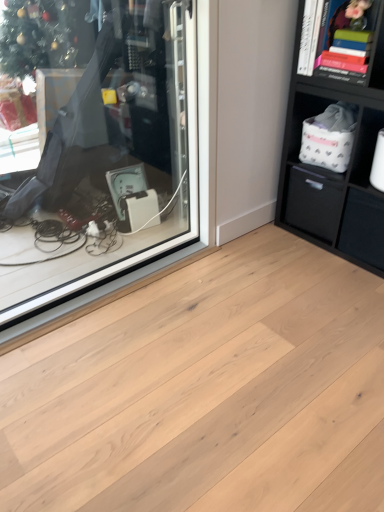
Question: Does transparent glass shop window at upper left have a greater width compared to matte black drawer at lower right, the 2th drawer when ordered from left to right?

Choices:
 (A) no
 (B) yes

Answer: (A)

Question: Does transparent glass shop window at upper left touch matte black drawer at lower right, the 1th drawer from the right?

Choices:
 (A) yes
 (B) no

Answer: (B)

Question: From a real-world perspective, is transparent glass shop window at upper left physically above matte black drawer at lower right, the 1th drawer from the right?

Choices:
 (A) yes
 (B) no

Answer: (A)

Question: Is transparent glass shop window at upper left smaller than matte black drawer at lower right, the 1th drawer from the right?

Choices:
 (A) yes
 (B) no

Answer: (B)

Question: From the image's perspective, is transparent glass shop window at upper left below matte black drawer at lower right, the 1th drawer from the right?

Choices:
 (A) yes
 (B) no

Answer: (B)

Question: From the image's perspective, is matte black drawer at lower right, the 2th drawer when ordered from left to right, located above or below natural wood plank at center?

Choices:
 (A) below
 (B) above

Answer: (B)

Question: Based on their sizes in the image, would you say matte black drawer at lower right, the 2th drawer when ordered from left to right, is bigger or smaller than natural wood plank at center?

Choices:
 (A) big
 (B) small

Answer: (B)

Question: From their relative heights in the image, would you say matte black drawer at lower right, the 1th drawer from the right, is taller or shorter than natural wood plank at center?

Choices:
 (A) tall
 (B) short

Answer: (A)

Question: In the image, is matte black drawer at lower right, the 1th drawer from the right, positioned in front of or behind natural wood plank at center?

Choices:
 (A) behind
 (B) front

Answer: (A)

Question: Is white fabric basket at right, which is counted as the first cabinet, starting from the right, in front of or behind hardcover book at upper right, placed as the second cabinet when sorted from right to left, in the image?

Choices:
 (A) front
 (B) behind

Answer: (A)

Question: Do you think white fabric basket at right, which appears as the 1th cabinet when ordered from the bottom, is within hardcover book at upper right, placed as the second cabinet when sorted from right to left, or outside of it?

Choices:
 (A) inside
 (B) outside

Answer: (B)

Question: Is white fabric basket at right, which appears as the 1th cabinet when ordered from the bottom, wider or thinner than hardcover book at upper right, the second cabinet ordered from the bottom?

Choices:
 (A) wide
 (B) thin

Answer: (B)

Question: Is point (x=367, y=183) positioned closer to the camera than point (x=380, y=36)?

Choices:
 (A) closer
 (B) farther

Answer: (B)

Question: In the image, is hardcover book at upper right, which appears as the first cabinet when viewed from the top, on the left side or the right side of white fabric basket at right, the second cabinet from the left?

Choices:
 (A) left
 (B) right

Answer: (A)

Question: From a real-world perspective, is hardcover book at upper right, which appears as the first cabinet when viewed from the top, positioned above or below white fabric basket at right, which is counted as the first cabinet, starting from the right?

Choices:
 (A) above
 (B) below

Answer: (A)